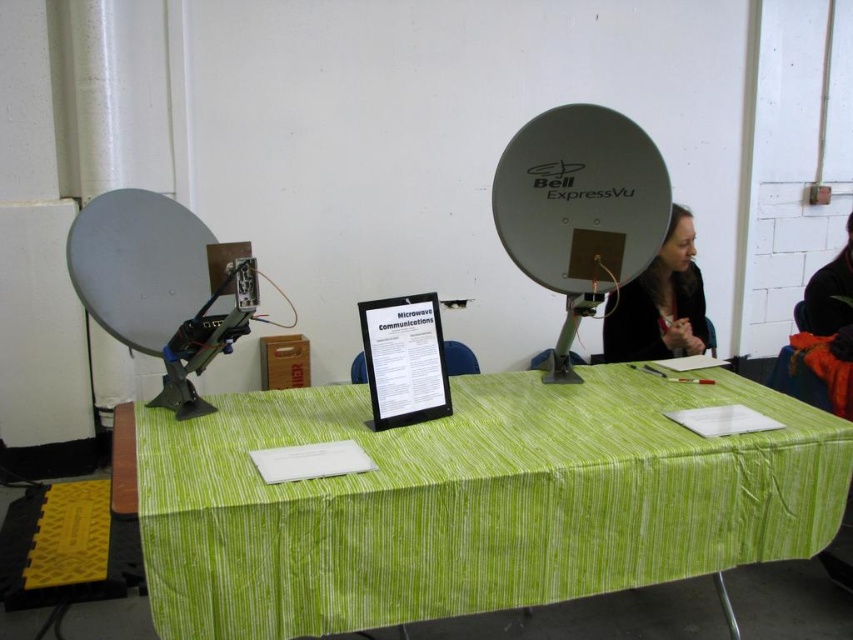
You are organizing an event and need to place a decorative item on the table. You have a green striped tablecloth at center and a smooth black hair at upper right. Which object is wider and can better accommodate the item?

The green striped tablecloth at center is wider than the smooth black hair at upper right, so it can better accommodate the decorative item.

You are standing at the back of the room looking at the table setup. Which object is closer to you, the green striped tablecloth at center or the smooth black hair at upper right?

The green striped tablecloth at center is closer to you because it is in front of the smooth black hair at upper right.

You are organizing an event and need to place a decorative item on the table. The green striped tablecloth at center and the smooth black hair at upper right are both present. Which object should you place the item on to ensure it is visible to attendees seated on the right side of the table?

You should place the item on the smooth black hair at upper right because it is positioned above the green striped tablecloth at center, making it more visible to attendees seated on the right side of the table.